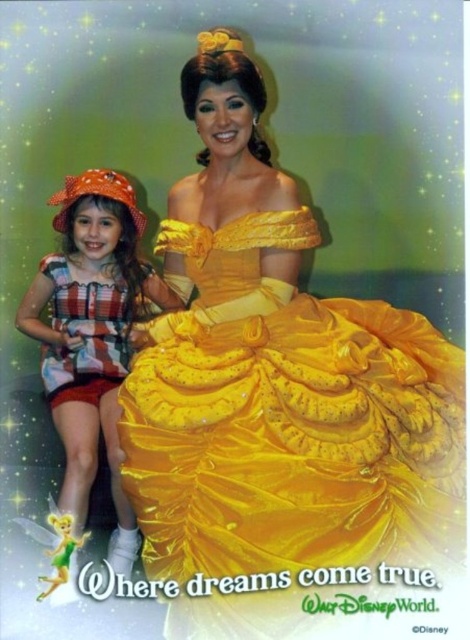
Can you confirm if shiny yellow dress at center is bigger than striped fabric dress at left?

Yes.

Is shiny yellow dress at center taller than striped fabric dress at left?

Correct, shiny yellow dress at center is much taller as striped fabric dress at left.

Does point (197, 180) lie in front of point (47, 256)?

Yes, point (197, 180) is closer to viewer.

In order to click on shiny yellow dress at center in this screenshot , I will do `click(275, 394)`.